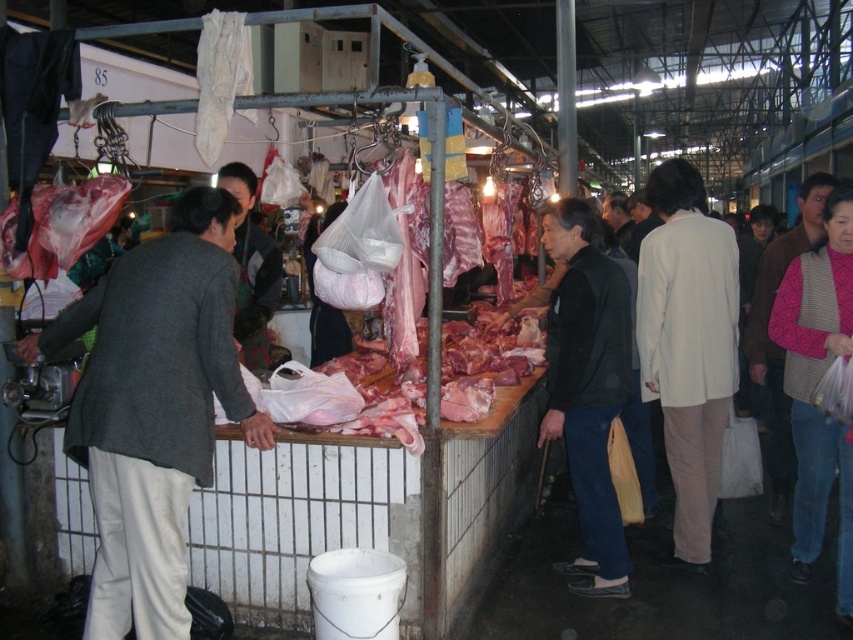
You are a customer carrying a heavy bag and need to approach the vendor at the meat stall. There is a white matte jacket at right and a dark gray sweater at center in your path. Given that your bag has a width of 1.5 meters, will you be able to pass between them without moving any objects?

The white matte jacket at right is 2.18 meters from the dark gray sweater at center. Since your bag is 1.5 meters wide, there is enough space between them to pass through without moving any objects.

You are a customer at the meat stall and see two jackets in the scene. Which jacket, the white matte jacket at right or the black matte jacket at center, is larger in size?

The white matte jacket at right is bigger than the black matte jacket at center.

You are a customer at the meat stall and want to ask the vendor about the price of the meat. The vendor is wearing a black matte jacket at center. There is also a white matte jacket at right nearby. Which jacket should you approach to find the vendor?

The vendor is wearing the black matte jacket at center, so you should approach the black matte jacket at center.